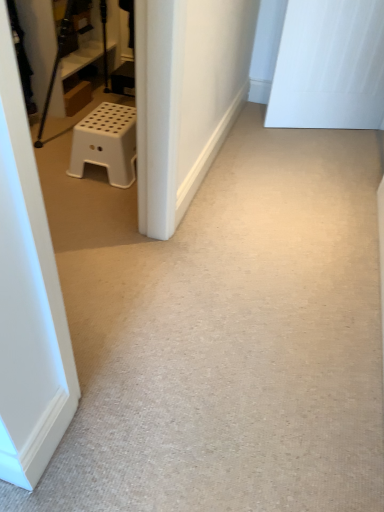
Question: From the image's perspective, relative to white plastic stool at left, is white matte door at upper right above or below?

Choices:
 (A) below
 (B) above

Answer: (B)

Question: Is white matte door at upper right situated inside white plastic stool at left or outside?

Choices:
 (A) inside
 (B) outside

Answer: (B)

Question: Considering the positions of white matte door at upper right and white plastic stool at left in the image, is white matte door at upper right taller or shorter than white plastic stool at left?

Choices:
 (A) short
 (B) tall

Answer: (B)

Question: In terms of height, does white plastic stool at left look taller or shorter compared to white matte door at upper right?

Choices:
 (A) short
 (B) tall

Answer: (A)

Question: Based on their sizes in the image, would you say white plastic stool at left is bigger or smaller than white matte door at upper right?

Choices:
 (A) small
 (B) big

Answer: (A)

Question: Considering the positions of point click(134, 126) and point click(370, 37), is point click(134, 126) closer or farther from the camera than point click(370, 37)?

Choices:
 (A) farther
 (B) closer

Answer: (B)

Question: Is white plastic stool at left in front of or behind white matte door at upper right in the image?

Choices:
 (A) front
 (B) behind

Answer: (A)